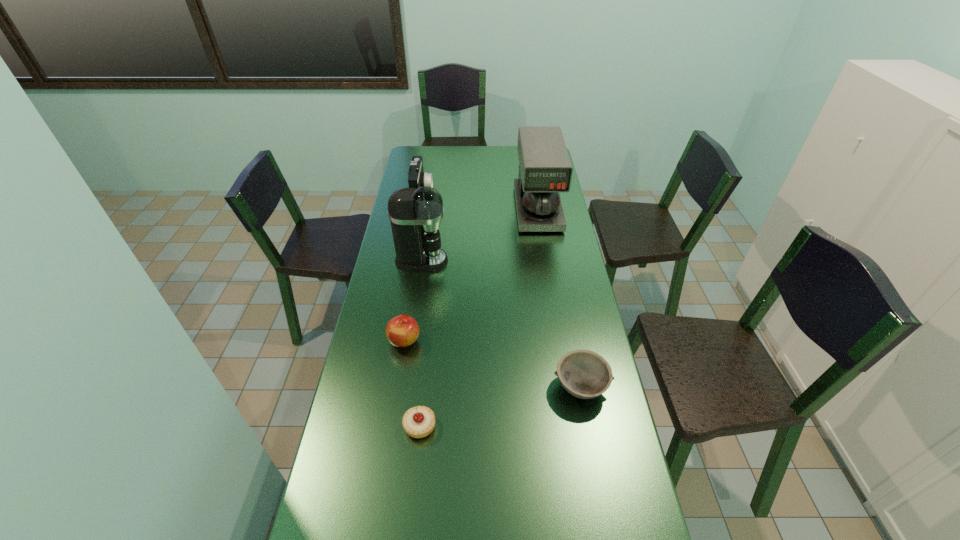
This screenshot has width=960, height=540. Find the location of `the third farthest object`. the third farthest object is located at coordinates 415,214.

This screenshot has height=540, width=960. I want to click on the left coffee maker, so click(x=415, y=214).

Where is `the right coffee maker`? The width and height of the screenshot is (960, 540). the right coffee maker is located at coordinates (545, 169).

I want to click on the fourth shortest object, so click(x=417, y=178).

The image size is (960, 540). Identify the location of apple. (402, 331).

Locate an element on the screen. This screenshot has width=960, height=540. the fourth farthest object is located at coordinates (402, 331).

The height and width of the screenshot is (540, 960). Identify the location of bowl. (583, 373).

Find the location of `the second nearest object`. the second nearest object is located at coordinates (583, 373).

Locate an element on the screen. This screenshot has height=540, width=960. pastry is located at coordinates (418, 422).

This screenshot has height=540, width=960. Identify the location of the nearest object. 418,422.